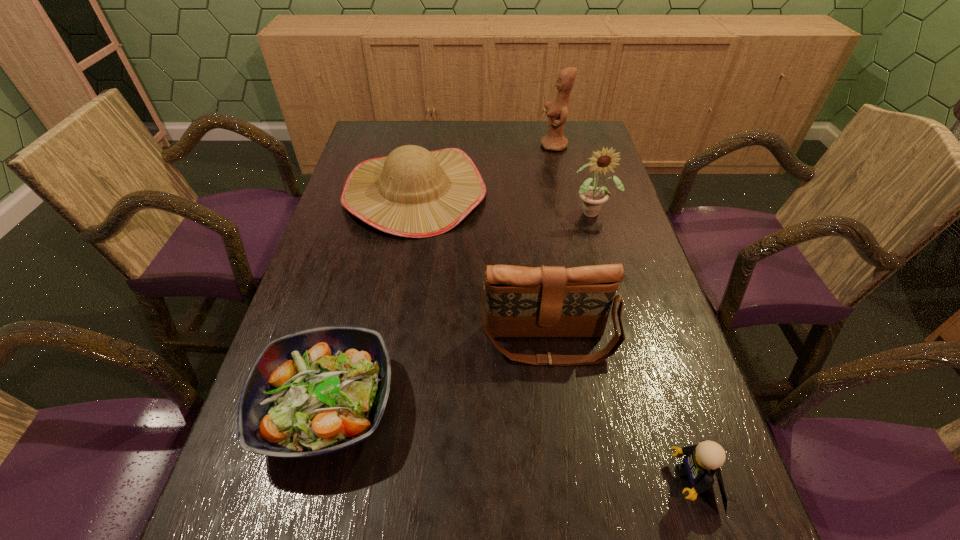
Where is `object that is the fifth closest to the shoulder bag`? This screenshot has height=540, width=960. object that is the fifth closest to the shoulder bag is located at coordinates (557, 111).

Point out which object is positioned as the fourth nearest to the salad plate. Please provide its 2D coordinates. Your answer should be formatted as a tuple, i.e. [(x, y)], where the tuple contains the x and y coordinates of a point satisfying the conditions above.

[(592, 198)]